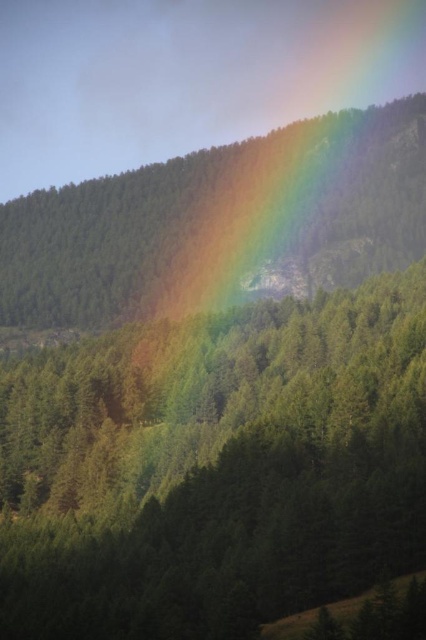
Question: Which of the following is the farthest from the observer?

Choices:
 (A) (218, 157)
 (B) (108, 563)

Answer: (A)

Question: Is green matte tree at center smaller than smooth green forest at upper center?

Choices:
 (A) no
 (B) yes

Answer: (B)

Question: Can you confirm if green matte tree at center is wider than smooth green forest at upper center?

Choices:
 (A) yes
 (B) no

Answer: (B)

Question: Which object appears farthest from the camera in this image?

Choices:
 (A) green matte tree at center
 (B) smooth green forest at upper center

Answer: (B)

Question: Can you confirm if green matte tree at center is positioned to the right of smooth green forest at upper center?

Choices:
 (A) yes
 (B) no

Answer: (A)

Question: Which of the following is the farthest from the observer?

Choices:
 (A) (322, 266)
 (B) (302, 408)

Answer: (A)